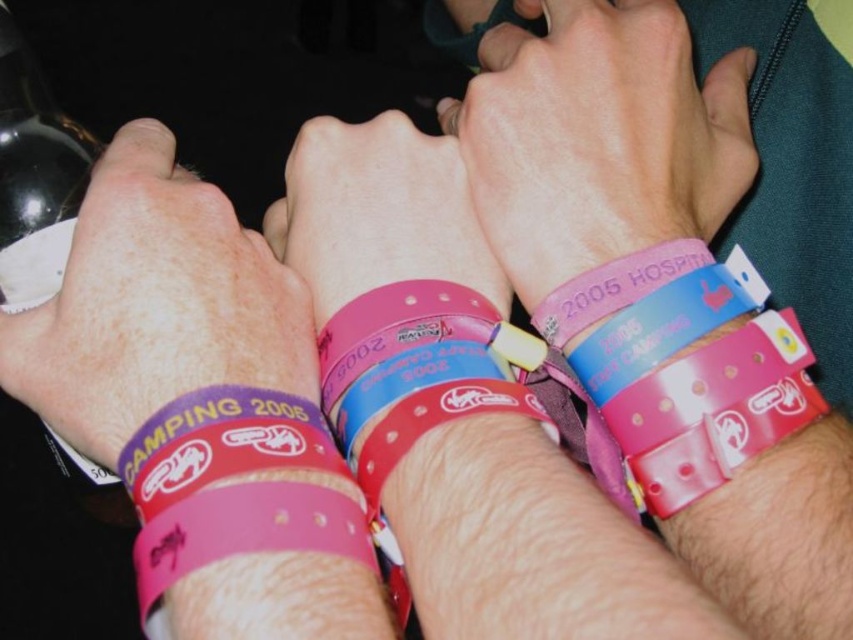
Question: Does pink rubber wristband at center come behind purple matte wristband at center?

Choices:
 (A) no
 (B) yes

Answer: (B)

Question: Which point appears closest to the camera in this image?

Choices:
 (A) (142, 360)
 (B) (24, 240)
 (C) (740, 90)

Answer: (A)

Question: Can you confirm if black matte bottle at upper left is positioned to the right of pink rubber wristband at lower center?

Choices:
 (A) no
 (B) yes

Answer: (A)

Question: Which of the following is the farthest from the observer?

Choices:
 (A) (204, 372)
 (B) (155, 566)
 (C) (722, 83)

Answer: (C)

Question: Which object is the farthest from the purple matte wristband at center?

Choices:
 (A) black matte bottle at upper left
 (B) pink rubber wristband at center

Answer: (B)

Question: Is black matte bottle at upper left behind pink rubber wristband at lower center?

Choices:
 (A) yes
 (B) no

Answer: (A)